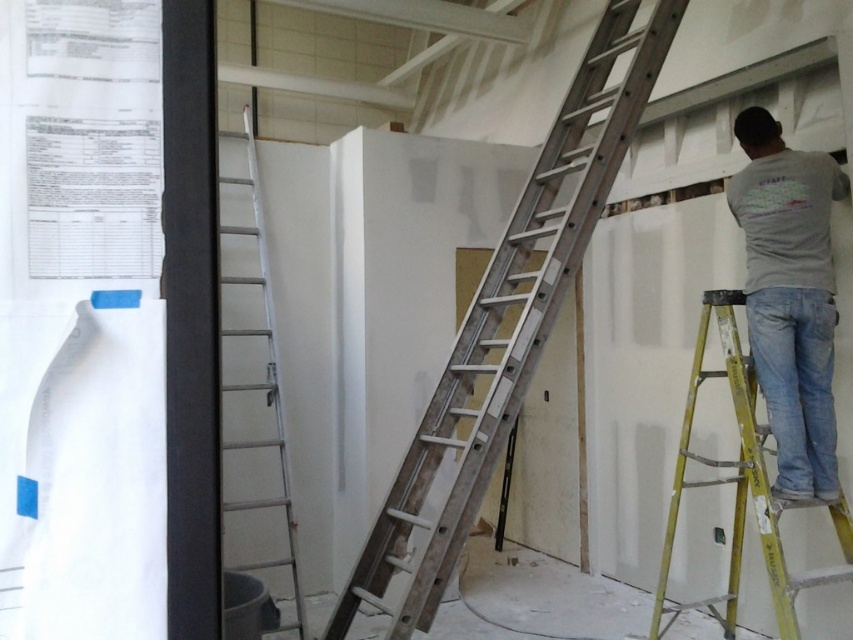
Question: Which of the following is the closest to the observer?

Choices:
 (A) gray cotton shirt at upper right
 (B) yellow/yellowish metallic ladder at right
 (C) metallic silver ladder at center
 (D) silver metallic ladder at left

Answer: (B)

Question: Among these points, which one is farthest from the camera?

Choices:
 (A) (724, 316)
 (B) (248, 148)
 (C) (405, 496)

Answer: (B)

Question: Is metallic silver ladder at center further to camera compared to yellow/yellowish metallic ladder at right?

Choices:
 (A) yes
 (B) no

Answer: (A)

Question: Is metallic silver ladder at center below silver metallic ladder at left?

Choices:
 (A) no
 (B) yes

Answer: (A)

Question: Does gray cotton shirt at upper right appear over yellow/yellowish metallic ladder at right?

Choices:
 (A) no
 (B) yes

Answer: (B)

Question: Among these objects, which one is farthest from the camera?

Choices:
 (A) metallic silver ladder at center
 (B) yellow/yellowish metallic ladder at right

Answer: (A)